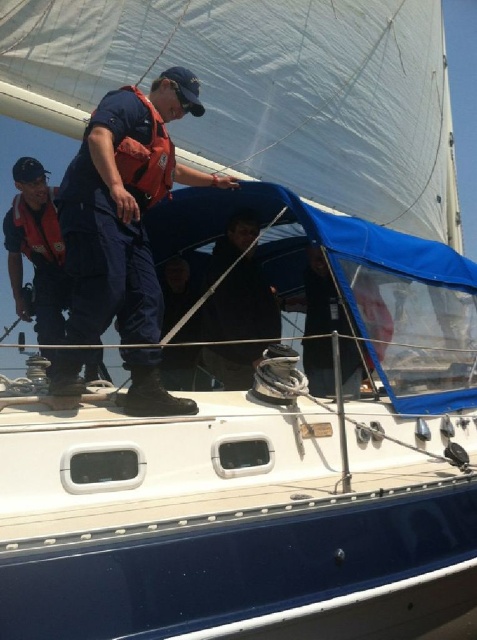
You are a sailor on the deck of the sailboat. You need to retrieve an item from the deck but must avoid touching any clothing items worn by the crew members. Which object should you avoid touching, the black matte jacket at center or the orange fabric life jacket at center?

The black matte jacket at center is below the orange fabric life jacket at center, so the orange fabric life jacket at center is the one being worn and should be avoided to prevent touching clothing items worn by the crew members.

You are a sailor on the deck of the boat and need to hang a flag from the tallest object at center. Which object should you choose between the blue cotton sailor at center and the black matte jacket at center?

The blue cotton sailor at center is much taller than the black matte jacket at center, so you should hang the flag from the blue cotton sailor at center.

You are a passenger on the sailboat and need to locate the blue cotton sailor at center. Based on the coordinates provided, where exactly would you find this sailor positioned on the boat?

The blue cotton sailor at center is located at the coordinates point (123,205), which places them in the central area of the boat.